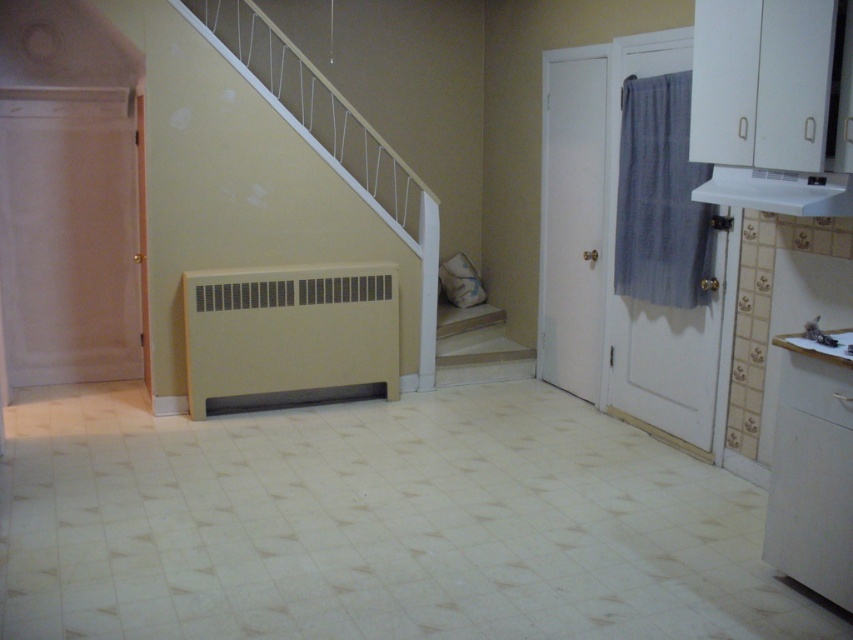
You are standing in the hallway and want to take a photo of both the point at coordinates (x=277, y=376) and the point at coordinates (x=837, y=454). Which point will appear closer to the camera in the photo?

The point at coordinates (x=277, y=376) will appear closer to the camera in the photo because it is further to the camera than the point at coordinates (x=837, y=454).

You are standing in the hallway and want to locate the beige matte radiator at lower center. According to the coordinates provided, where is it positioned?

The beige matte radiator at lower center is located at coordinates point (289, 330).